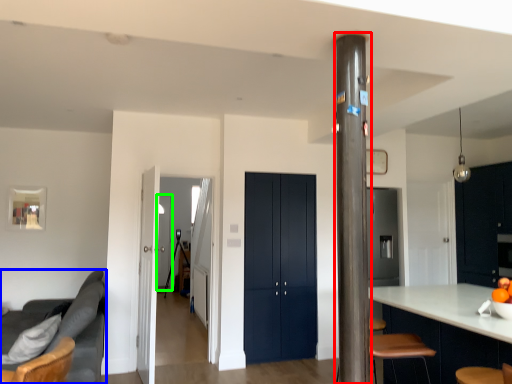
Question: Based on their relative distances, which object is nearer to pillar (highlighted by a red box)? Choose from studio couch (highlighted by a blue box) and glass door (highlighted by a green box).

Choices:
 (A) studio couch
 (B) glass door

Answer: (A)